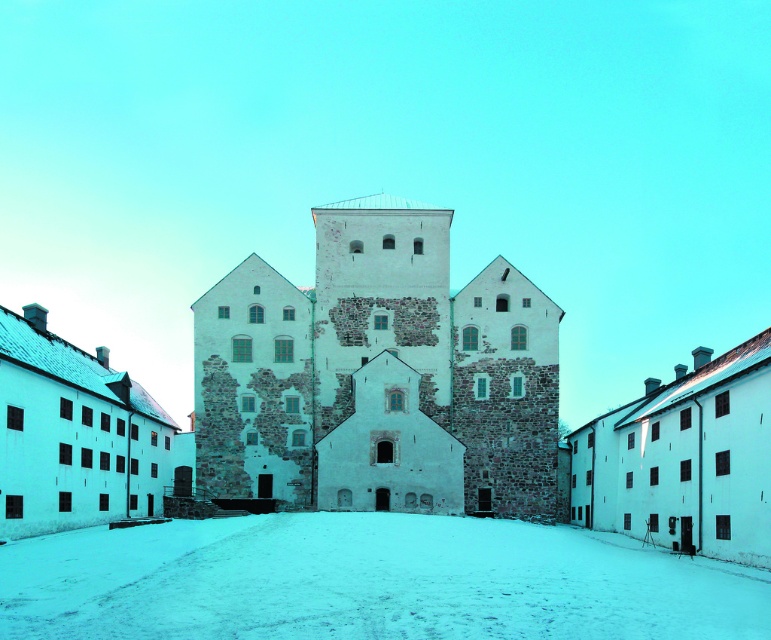
You are standing at the base of the white stone tower at center and want to walk to the white powdery snow at center. Is the snow at the same level as the tower, or is it lower?

The white stone tower at center is located above white powdery snow at center, so the snow is lower than the tower.

You are a tourist standing in front of the historical stone building complex. You see the white stone tower at center and the white powdery snow at center. Which object has a smaller width when viewed from this angle?

The white stone tower at center has a smaller width than the white powdery snow at center.

You are standing at point (217, 436) and want to reach the entrance of the castle. The entrance is located at the base of the central tower. If the distance between you and the entrance is 107.47 meters, can you safely cross the distance if your maximum walking distance is 110 meters?

The distance between you and the entrance is 107.47 meters, which is less than your maximum walking distance of 110 meters, so you can safely reach the entrance.